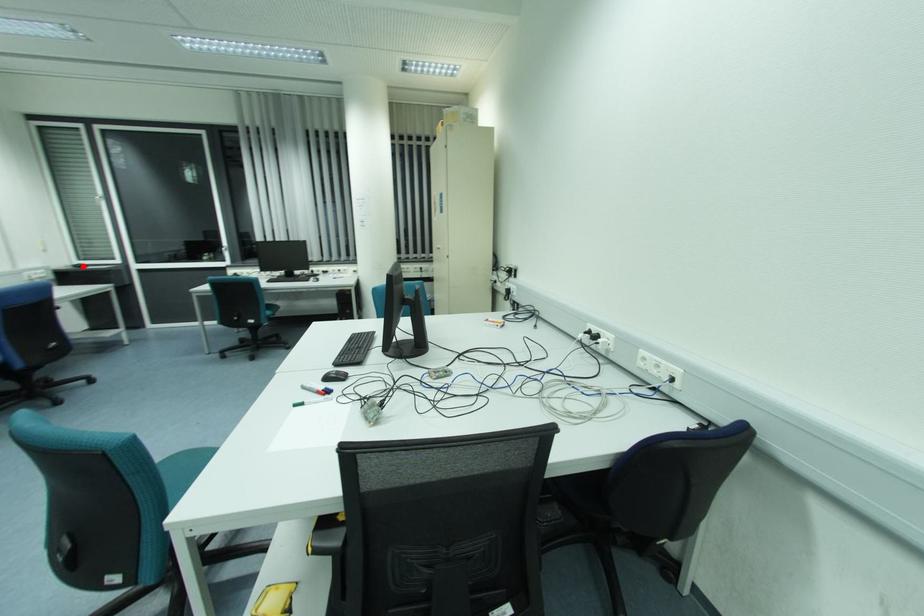
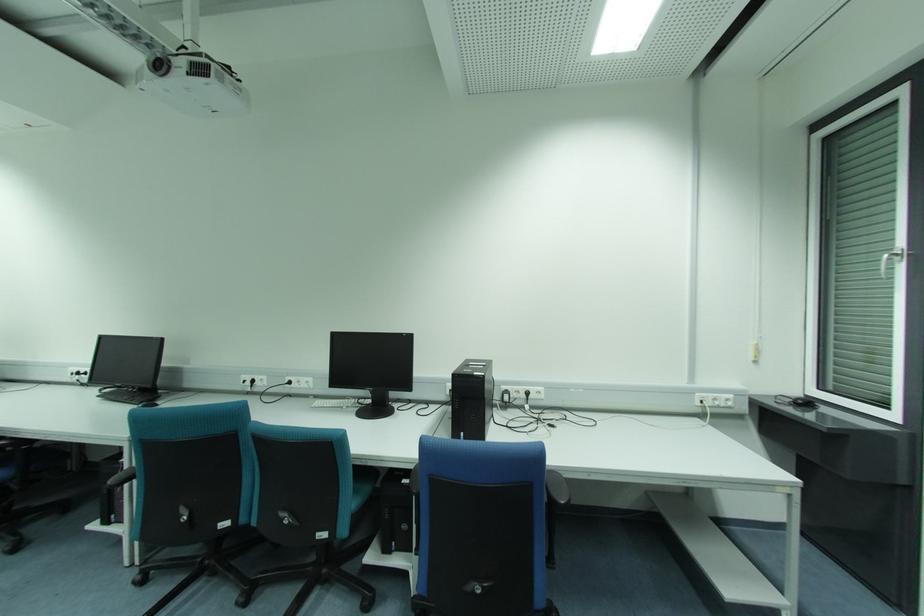
Find the pixel in the second image that matches the highlighted location in the first image.

(808, 403)